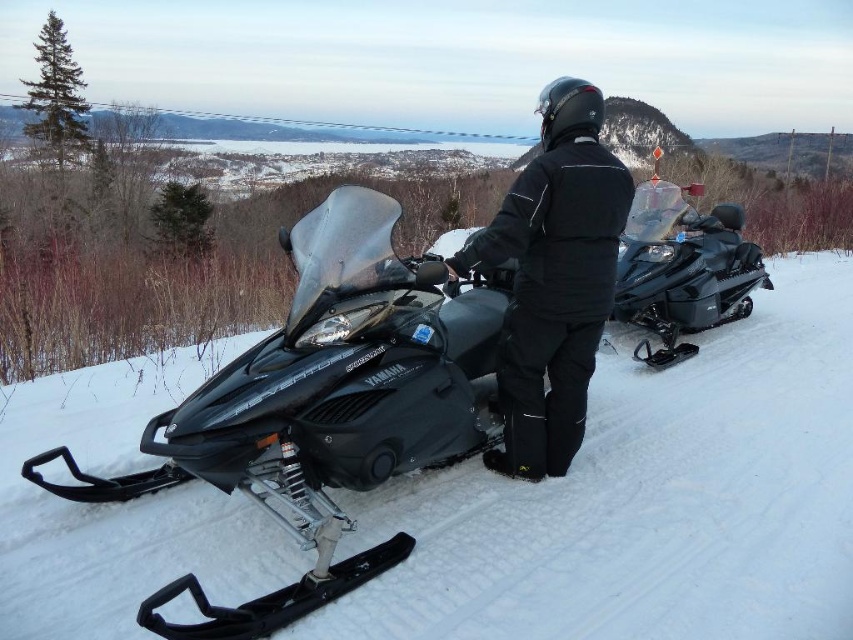
You are a snowmobile tour guide and need to direct your client to the snowmobile located at point (x=326, y=404). Which snowmobile should they choose based on the coordinates provided?

The snowmobile located at point (x=326, y=404) is the matte black snowmobile at center.

You are planning to take a snowmobile tour and want to choose between the matte black snowmobile at center and the shiny black snowmobile at right. Based on their positions in the image, which one is more likely to be accessible for you to start riding immediately?

The matte black snowobile at center is positioned under the shiny black snowmobile at right, so the shiny black snowmobile at right is more likely to be accessible for you to start riding immediately because it is not blocked by the other snowmobile.